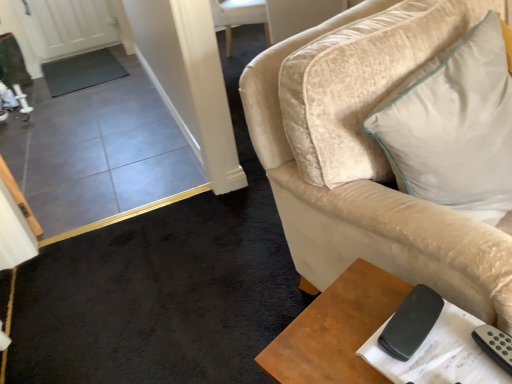
Question: Is black matte remote at lower right oriented towards white soft cushion at upper right?

Choices:
 (A) yes
 (B) no

Answer: (B)

Question: Does black matte remote at lower right have a lesser height compared to white soft cushion at upper right?

Choices:
 (A) yes
 (B) no

Answer: (A)

Question: Does black matte remote at lower right lie behind white soft cushion at upper right?

Choices:
 (A) no
 (B) yes

Answer: (B)

Question: Is black matte remote at lower right surrounding white soft cushion at upper right?

Choices:
 (A) yes
 (B) no

Answer: (B)

Question: Can you confirm if black matte remote at lower right is wider than white soft cushion at upper right?

Choices:
 (A) no
 (B) yes

Answer: (A)

Question: Would you say black matte remote at lower right is inside or outside brown wooden table at lower right?

Choices:
 (A) inside
 (B) outside

Answer: (B)

Question: In terms of size, does black matte remote at lower right appear bigger or smaller than brown wooden table at lower right?

Choices:
 (A) small
 (B) big

Answer: (A)

Question: Would you say black matte remote at lower right is to the left or to the right of brown wooden table at lower right in the picture?

Choices:
 (A) left
 (B) right

Answer: (B)

Question: In the image, is black matte remote at lower right positioned in front of or behind brown wooden table at lower right?

Choices:
 (A) behind
 (B) front

Answer: (A)

Question: Considering the positions of black matte remote at lower right and white soft cushion at upper right in the image, is black matte remote at lower right taller or shorter than white soft cushion at upper right?

Choices:
 (A) tall
 (B) short

Answer: (B)

Question: Considering the positions of black matte remote at lower right and white soft cushion at upper right in the image, is black matte remote at lower right wider or thinner than white soft cushion at upper right?

Choices:
 (A) thin
 (B) wide

Answer: (A)

Question: Visually, is black matte remote at lower right positioned to the left or to the right of white soft cushion at upper right?

Choices:
 (A) right
 (B) left

Answer: (B)

Question: Would you say black matte remote at lower right is inside or outside white soft cushion at upper right?

Choices:
 (A) outside
 (B) inside

Answer: (A)

Question: Considering the relative positions of white soft cushion at upper right and brown wooden table at lower right in the image provided, is white soft cushion at upper right to the left or to the right of brown wooden table at lower right?

Choices:
 (A) left
 (B) right

Answer: (B)

Question: Is white soft cushion at upper right in front of or behind brown wooden table at lower right in the image?

Choices:
 (A) front
 (B) behind

Answer: (B)